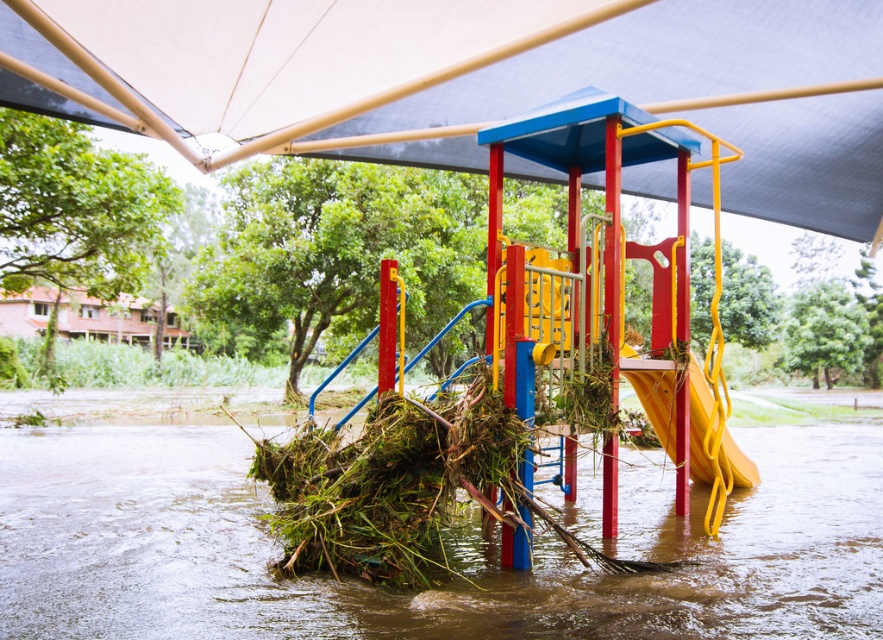
This screenshot has width=883, height=640. What do you see at coordinates (473, 81) in the screenshot?
I see `white fabric canopy at upper center` at bounding box center [473, 81].

Does point (462, 97) come closer to viewer compared to point (161, 540)?

That is False.

Is point (484, 99) in front of point (193, 573)?

No, (484, 99) is further to viewer.

In order to click on white fabric canopy at upper center in this screenshot , I will do `click(473, 81)`.

Between white fabric canopy at upper center and yellow matte slide at lower right, which one is positioned lower?

yellow matte slide at lower right is below.

This screenshot has width=883, height=640. What do you see at coordinates (473, 81) in the screenshot?
I see `white fabric canopy at upper center` at bounding box center [473, 81].

Does point (809, 106) come in front of point (734, 444)?

No, it is not.

At what (x,y) coordinates should I click in order to perform the action: click on white fabric canopy at upper center. Please return your answer as a coordinate pair (x, y). Looking at the image, I should click on (473, 81).

Between brown muddy water at center and yellow matte slide at lower right, which one has more height?

With more height is yellow matte slide at lower right.

Can you confirm if brown muddy water at center is positioned to the right of yellow matte slide at lower right?

No, brown muddy water at center is not to the right of yellow matte slide at lower right.

Find the location of a particular element. brown muddy water at center is located at coordinates (444, 547).